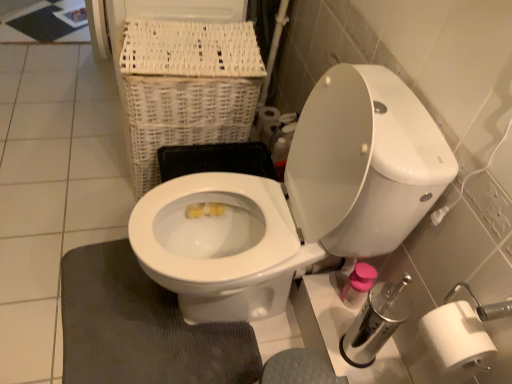
Question: Considering the relative sizes of white glossy toilet at center and white matte toilet paper at right in the image provided, is white glossy toilet at center taller than white matte toilet paper at right?

Choices:
 (A) yes
 (B) no

Answer: (A)

Question: Does white glossy toilet at center appear on the right side of white matte toilet paper at right?

Choices:
 (A) no
 (B) yes

Answer: (A)

Question: Does white glossy toilet at center appear on the left side of white matte toilet paper at right?

Choices:
 (A) yes
 (B) no

Answer: (A)

Question: From a real-world perspective, does white glossy toilet at center stand above white matte toilet paper at right?

Choices:
 (A) yes
 (B) no

Answer: (A)

Question: Can you confirm if white glossy toilet at center is wider than white matte toilet paper at right?

Choices:
 (A) no
 (B) yes

Answer: (B)

Question: In the image, is white matte toilet paper at right on the left side or the right side of dark gray textured bath mat at lower left?

Choices:
 (A) left
 (B) right

Answer: (B)

Question: From the image's perspective, relative to dark gray textured bath mat at lower left, is white matte toilet paper at right above or below?

Choices:
 (A) below
 (B) above

Answer: (B)

Question: From a real-world perspective, is white matte toilet paper at right positioned above or below dark gray textured bath mat at lower left?

Choices:
 (A) above
 (B) below

Answer: (A)

Question: Looking at the image, does white matte toilet paper at right seem bigger or smaller compared to dark gray textured bath mat at lower left?

Choices:
 (A) big
 (B) small

Answer: (B)

Question: Looking at their shapes, would you say white wicker basket at upper left is wider or thinner than white matte toilet paper at right?

Choices:
 (A) thin
 (B) wide

Answer: (B)

Question: Considering the positions of white wicker basket at upper left and white matte toilet paper at right in the image, is white wicker basket at upper left taller or shorter than white matte toilet paper at right?

Choices:
 (A) short
 (B) tall

Answer: (B)

Question: Does point (234, 34) appear closer or farther from the camera than point (280, 124)?

Choices:
 (A) farther
 (B) closer

Answer: (B)

Question: From the image's perspective, is white wicker basket at upper left positioned above or below white matte toilet paper at right?

Choices:
 (A) below
 (B) above

Answer: (B)

Question: Is dark gray textured bath mat at lower left wider or thinner than white matte toilet paper at right?

Choices:
 (A) wide
 (B) thin

Answer: (A)

Question: Based on their positions, is dark gray textured bath mat at lower left located to the left or right of white matte toilet paper at right?

Choices:
 (A) right
 (B) left

Answer: (B)